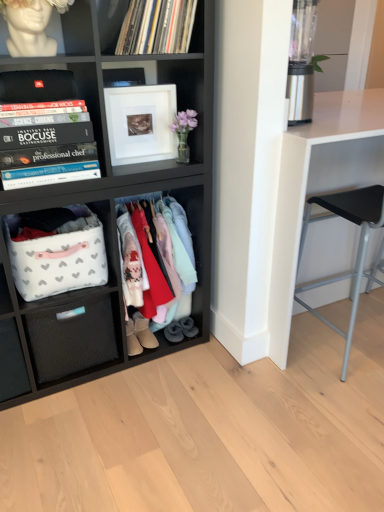
At what (x,y) coordinates should I click in order to perform the action: click on space that is in front of white glossy table at right. Please return your answer as a coordinate pair (x, y). Looking at the image, I should click on (332, 404).